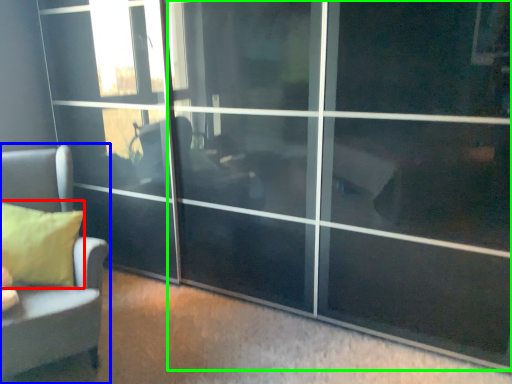
Question: Which object is the closest to the pillow (highlighted by a red box)? Choose among these: furniture (highlighted by a blue box) or screen door (highlighted by a green box).

Choices:
 (A) furniture
 (B) screen door

Answer: (A)